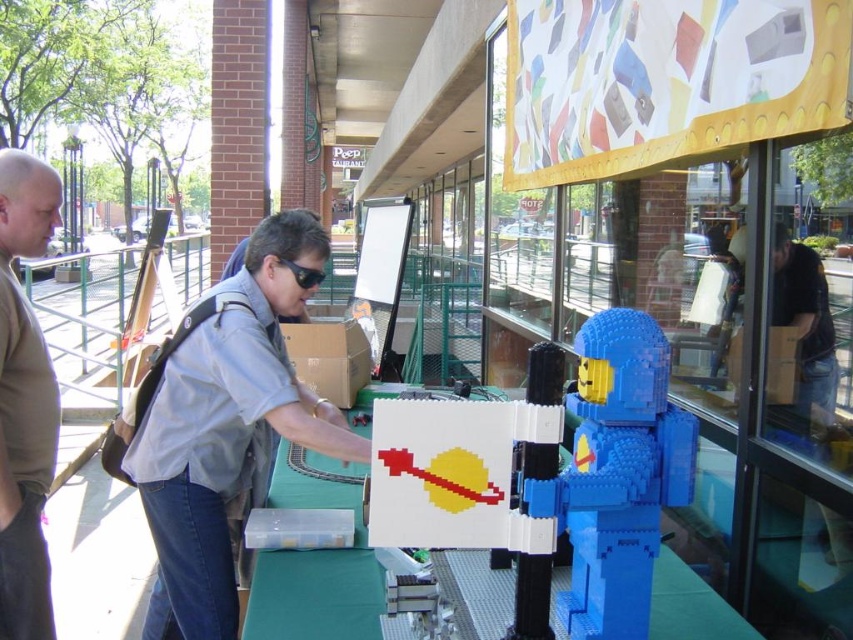
Who is more distant from viewer, (346, 456) or (297, 371)?

The point (297, 371) is more distant.

Which is more to the left, light blue shirt at center or brown cardboard box at center?

From the viewer's perspective, light blue shirt at center appears more on the left side.

Which is behind, point (224, 625) or point (331, 372)?

The point (331, 372) is behind.

Identify the location of light blue shirt at center. (227, 433).

Does light blue shirt at center come in front of black plastic goggles at center?

Yes.

Locate an element on the screen. The width and height of the screenshot is (853, 640). light blue shirt at center is located at coordinates (227, 433).

You are a GUI agent. You are given a task and a screenshot of the screen. Output one action in this format:
    pyautogui.click(x=<x>, y=<y>)
    Task: Click on the light blue shirt at center
    The image size is (853, 640).
    Given the screenshot: What is the action you would take?
    pyautogui.click(x=227, y=433)

Which is in front, point (36, 548) or point (296, 268)?

Positioned in front is point (36, 548).

Does point (57, 396) come farther from viewer compared to point (309, 276)?

No, it is not.

Where is `matte khaki shirt at left`? This screenshot has width=853, height=640. matte khaki shirt at left is located at coordinates (24, 401).